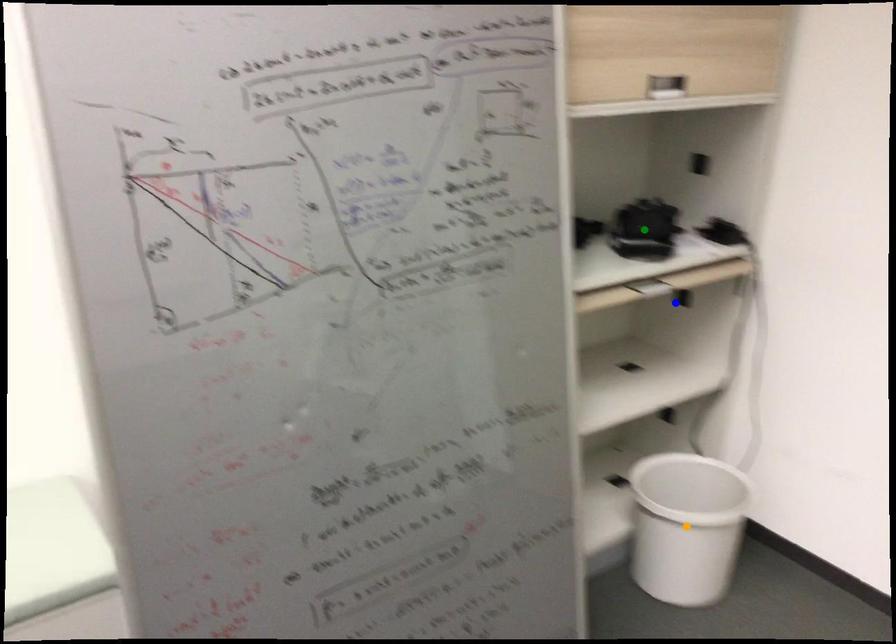
Order these from farthest to nearest:
orange point
blue point
green point

blue point
green point
orange point